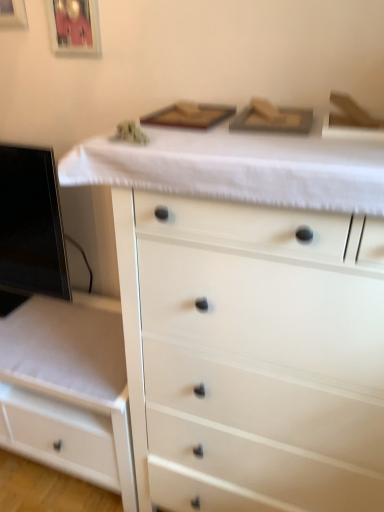
Question: Could you tell me if white matte chest of drawers at center, which is counted as the 1th chest of drawers, starting from the right, is facing matte glass picture frame at upper left, which is counted as the second picture frame, starting from the left?

Choices:
 (A) yes
 (B) no

Answer: (B)

Question: From the image's perspective, is white matte chest of drawers at center, the second chest of drawers when ordered from left to right, below matte glass picture frame at upper left, the 1th picture frame in the right-to-left sequence?

Choices:
 (A) yes
 (B) no

Answer: (A)

Question: Is the position of white matte chest of drawers at center, which is counted as the 1th chest of drawers, starting from the right, more distant than that of matte glass picture frame at upper left, the 1th picture frame in the right-to-left sequence?

Choices:
 (A) no
 (B) yes

Answer: (A)

Question: Is matte glass picture frame at upper left, the 1th picture frame in the right-to-left sequence, surrounded by white matte chest of drawers at center, the second chest of drawers when ordered from left to right?

Choices:
 (A) yes
 (B) no

Answer: (B)

Question: Considering the relative sizes of white matte chest of drawers at center, the second chest of drawers when ordered from left to right, and matte glass picture frame at upper left, the 1th picture frame in the right-to-left sequence, in the image provided, is white matte chest of drawers at center, the second chest of drawers when ordered from left to right, shorter than matte glass picture frame at upper left, the 1th picture frame in the right-to-left sequence,?

Choices:
 (A) no
 (B) yes

Answer: (A)

Question: Is white matte chest of drawers at center, which is counted as the 1th chest of drawers, starting from the right, outside of matte glass picture frame at upper left, which is counted as the second picture frame, starting from the left?

Choices:
 (A) no
 (B) yes

Answer: (B)

Question: Is matte glass picture frame at upper left, which is counted as the second picture frame, starting from the left, a part of black glossy computer monitor at left?

Choices:
 (A) no
 (B) yes

Answer: (A)

Question: Is black glossy computer monitor at left at the right side of matte glass picture frame at upper left, the 1th picture frame in the right-to-left sequence?

Choices:
 (A) no
 (B) yes

Answer: (A)

Question: Is black glossy computer monitor at left directly adjacent to matte glass picture frame at upper left, which is counted as the second picture frame, starting from the left?

Choices:
 (A) yes
 (B) no

Answer: (B)

Question: Can you confirm if black glossy computer monitor at left is bigger than matte glass picture frame at upper left, the 1th picture frame in the right-to-left sequence?

Choices:
 (A) yes
 (B) no

Answer: (A)

Question: Is black glossy computer monitor at left positioned behind matte glass picture frame at upper left, which is counted as the second picture frame, starting from the left?

Choices:
 (A) yes
 (B) no

Answer: (A)

Question: Could you tell me if black glossy computer monitor at left is turned towards matte glass picture frame at upper left, the 1th picture frame in the right-to-left sequence?

Choices:
 (A) yes
 (B) no

Answer: (B)

Question: Is white matte chest of drawers at center, the second chest of drawers when ordered from left to right, located within metallic silver picture frame at upper left, the first picture frame when ordered from left to right?

Choices:
 (A) no
 (B) yes

Answer: (A)